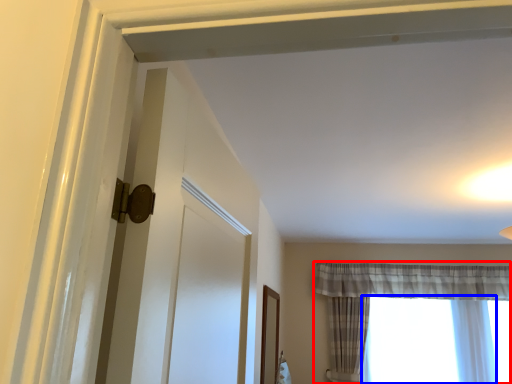
Question: Which of the following is the closest to the observer, curtain (highlighted by a red box) or window (highlighted by a blue box)?

Choices:
 (A) curtain
 (B) window

Answer: (A)